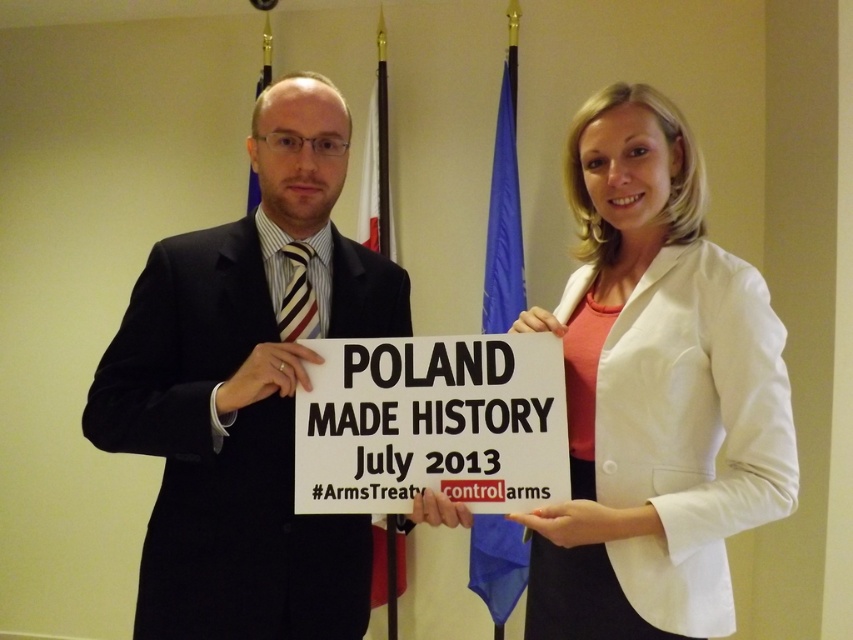
Measure the distance between white matte blazer at center and camera.

white matte blazer at center is 4.15 feet from camera.

From the picture: Who is shorter, white matte blazer at center or black suit at center?

white matte blazer at center

At what (x,y) coordinates should I click in order to perform the action: click on white matte blazer at center. Please return your answer as a coordinate pair (x, y). Image resolution: width=853 pixels, height=640 pixels. Looking at the image, I should click on (654, 392).

Locate an element on the screen. The image size is (853, 640). white matte blazer at center is located at coordinates (654, 392).

Between point (750, 371) and point (495, 378), which one is positioned behind?

Positioned behind is point (495, 378).

Locate an element on the screen. Image resolution: width=853 pixels, height=640 pixels. white matte blazer at center is located at coordinates (654, 392).

The width and height of the screenshot is (853, 640). What are the coordinates of `white matte blazer at center` in the screenshot? It's located at (654, 392).

Is black suit at center to the left of white paper sign at center from the viewer's perspective?

Indeed, black suit at center is positioned on the left side of white paper sign at center.

What do you see at coordinates (247, 392) in the screenshot? The height and width of the screenshot is (640, 853). I see `black suit at center` at bounding box center [247, 392].

This screenshot has height=640, width=853. What are the coordinates of `black suit at center` in the screenshot? It's located at (247, 392).